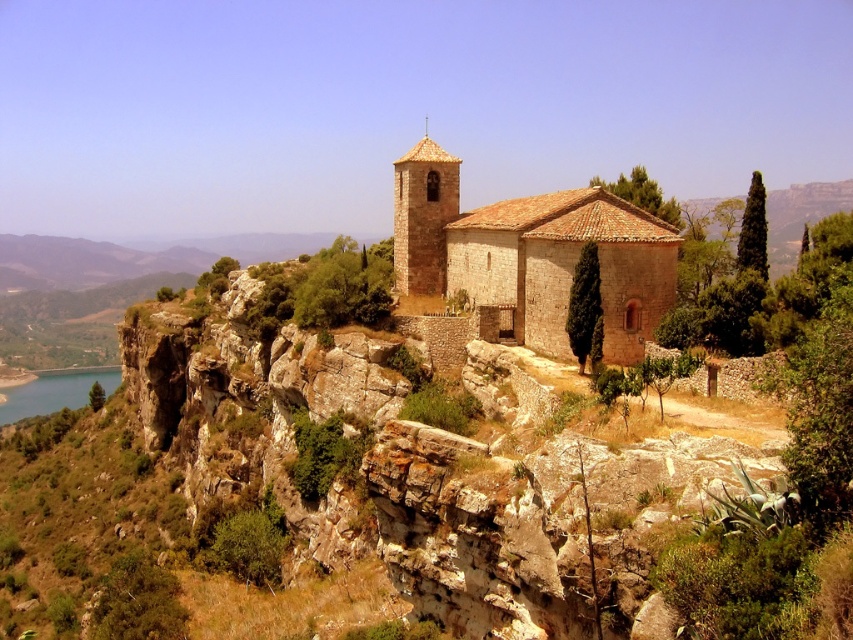
Question: Which object is closer to the camera taking this photo?

Choices:
 (A) blue smooth water at lower left
 (B) brown stone church at center

Answer: (B)

Question: Which point is closer to the camera taking this photo?

Choices:
 (A) (415, 225)
 (B) (62, 369)

Answer: (A)

Question: Can you confirm if brown stone church at center is positioned below smooth stone tower at center?

Choices:
 (A) yes
 (B) no

Answer: (A)

Question: Among these objects, which one is nearest to the camera?

Choices:
 (A) smooth stone tower at center
 (B) blue smooth water at lower left
 (C) brown stone church at center

Answer: (C)

Question: From the image, what is the correct spatial relationship of brown stone church at center in relation to blue smooth water at lower left?

Choices:
 (A) below
 (B) above

Answer: (B)

Question: Is brown stone church at center to the right of blue smooth water at lower left from the viewer's perspective?

Choices:
 (A) no
 (B) yes

Answer: (B)